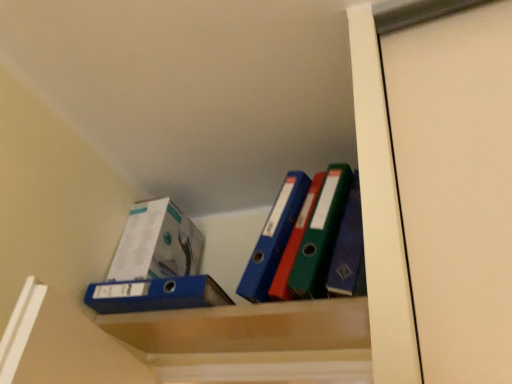
Question: Does matte plastic cabinet at center appear on the left side of blue matte folder at center?

Choices:
 (A) no
 (B) yes

Answer: (A)

Question: Is matte plastic cabinet at center behind blue matte folder at center?

Choices:
 (A) no
 (B) yes

Answer: (A)

Question: Is matte plastic cabinet at center facing away from blue matte folder at center?

Choices:
 (A) no
 (B) yes

Answer: (A)

Question: From the image's perspective, would you say matte plastic cabinet at center is shown under blue matte folder at center?

Choices:
 (A) yes
 (B) no

Answer: (A)

Question: Does matte plastic cabinet at center have a smaller size compared to blue matte folder at center?

Choices:
 (A) no
 (B) yes

Answer: (B)

Question: Is white glossy box at upper left situated inside blue matte folder at center or outside?

Choices:
 (A) outside
 (B) inside

Answer: (A)

Question: From a real-world perspective, is white glossy box at upper left above or below blue matte folder at center?

Choices:
 (A) above
 (B) below

Answer: (A)

Question: Considering the positions of point (133, 208) and point (190, 291), is point (133, 208) closer or farther from the camera than point (190, 291)?

Choices:
 (A) closer
 (B) farther

Answer: (B)

Question: Considering their positions, is white glossy box at upper left located in front of or behind blue matte folder at center?

Choices:
 (A) front
 (B) behind

Answer: (B)

Question: Considering the relative positions of white glossy box at upper left and matte plastic cabinet at center in the image provided, is white glossy box at upper left to the left or to the right of matte plastic cabinet at center?

Choices:
 (A) left
 (B) right

Answer: (A)

Question: Is white glossy box at upper left wider or thinner than matte plastic cabinet at center?

Choices:
 (A) wide
 (B) thin

Answer: (A)

Question: Is white glossy box at upper left situated inside matte plastic cabinet at center or outside?

Choices:
 (A) inside
 (B) outside

Answer: (B)

Question: Is point (183, 268) positioned closer to the camera than point (330, 329)?

Choices:
 (A) closer
 (B) farther

Answer: (B)

Question: Considering the positions of blue matte folder at center and matte plastic cabinet at center in the image, is blue matte folder at center taller or shorter than matte plastic cabinet at center?

Choices:
 (A) short
 (B) tall

Answer: (B)

Question: Considering their positions, is blue matte folder at center located in front of or behind matte plastic cabinet at center?

Choices:
 (A) front
 (B) behind

Answer: (B)